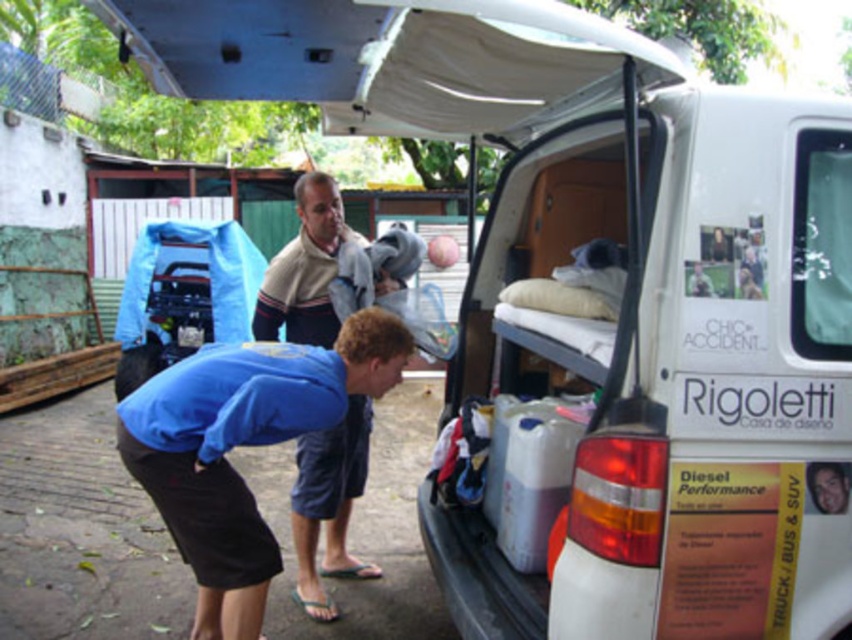
Does blue fabric shirt at lower left appear on the right side of beige striped sweater at center?

In fact, blue fabric shirt at lower left is to the left of beige striped sweater at center.

Does blue fabric shirt at lower left appear under beige striped sweater at center?

Actually, blue fabric shirt at lower left is above beige striped sweater at center.

Does point (285, 432) come farther from viewer compared to point (315, 269)?

No.

Find the location of `blue fabric shirt at lower left`. blue fabric shirt at lower left is located at coordinates (242, 445).